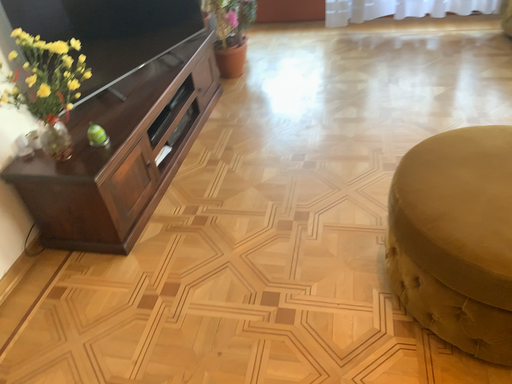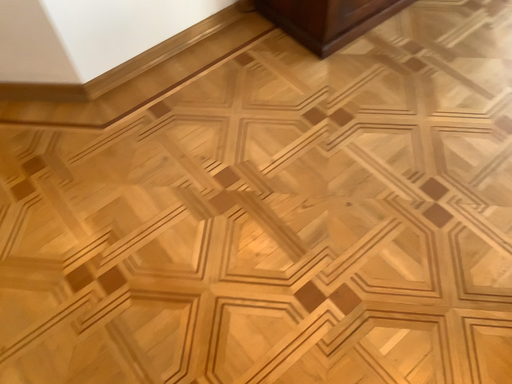
Question: Which way did the camera rotate in the video?

Choices:
 (A) rotated downward
 (B) rotated upward

Answer: (A)